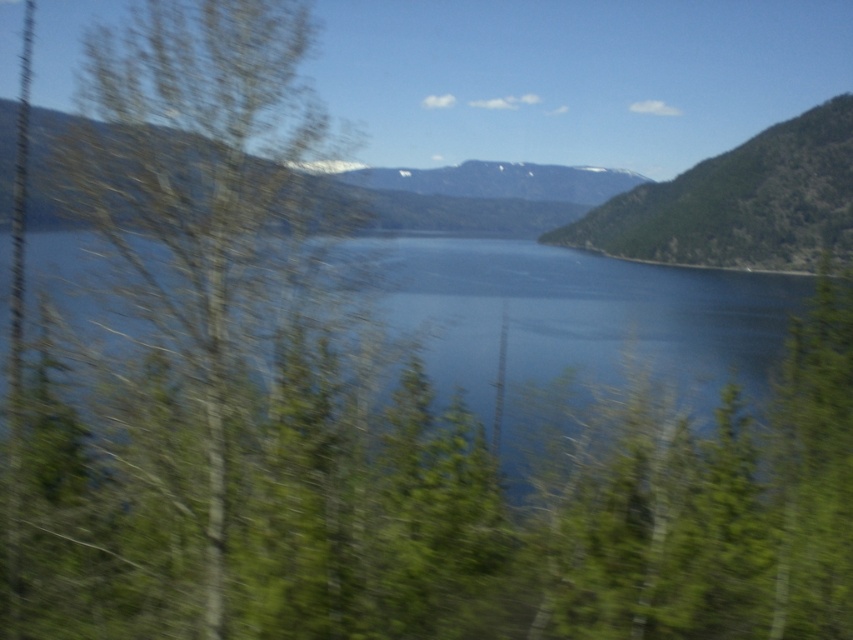
Which of these two, blue water at center or green textured hillside at upper right, stands shorter?

blue water at center

Who is positioned more to the right, blue water at center or green textured hillside at upper right?

From the viewer's perspective, green textured hillside at upper right appears more on the right side.

Identify the location of blue water at center. (573, 324).

Can you confirm if green leafy tree at left is thinner than green textured hillside at upper right?

Indeed, green leafy tree at left has a lesser width compared to green textured hillside at upper right.

Who is lower down, green leafy tree at left or green textured hillside at upper right?

green leafy tree at left

Locate an element on the screen. green leafy tree at left is located at coordinates (207, 362).

Can you confirm if green leafy tree at left is positioned to the left of blue water at center?

Correct, you'll find green leafy tree at left to the left of blue water at center.

Can you confirm if green leafy tree at left is positioned below blue water at center?

Correct, green leafy tree at left is located below blue water at center.

What do you see at coordinates (207, 362) in the screenshot?
I see `green leafy tree at left` at bounding box center [207, 362].

You are a GUI agent. You are given a task and a screenshot of the screen. Output one action in this format:
    pyautogui.click(x=<x>, y=<y>)
    Task: Click on the green leafy tree at left
    
    Given the screenshot: What is the action you would take?
    pyautogui.click(x=207, y=362)